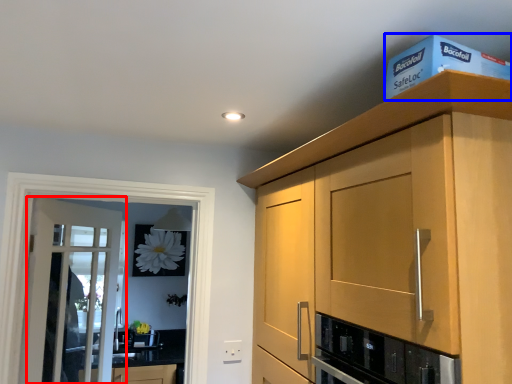
Question: Among these objects, which one is farthest to the camera, door (highlighted by a red box) or box (highlighted by a blue box)?

Choices:
 (A) door
 (B) box

Answer: (A)